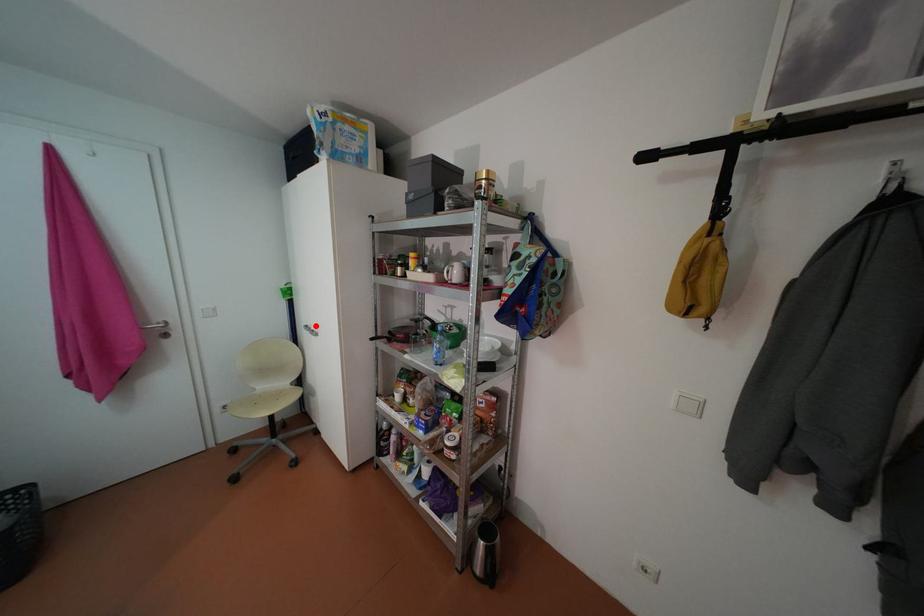
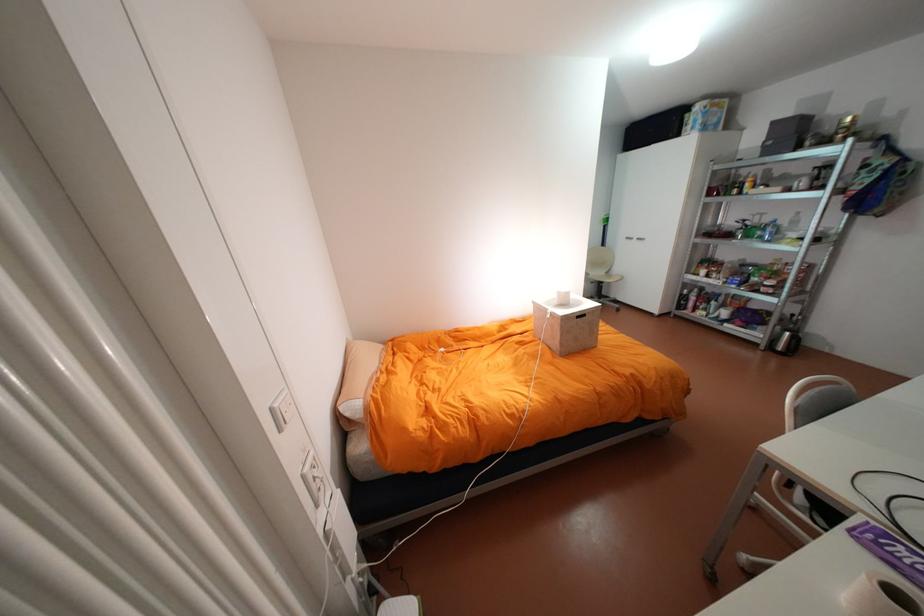
Question: I am providing you with two images of the same scene from different viewpoints. Image1 has a red point marked. In image2, the corresponding 3D location appears at what relative position? Reply with the corresponding letter.

Choices:
 (A) Closer
 (B) Farther

Answer: (A)